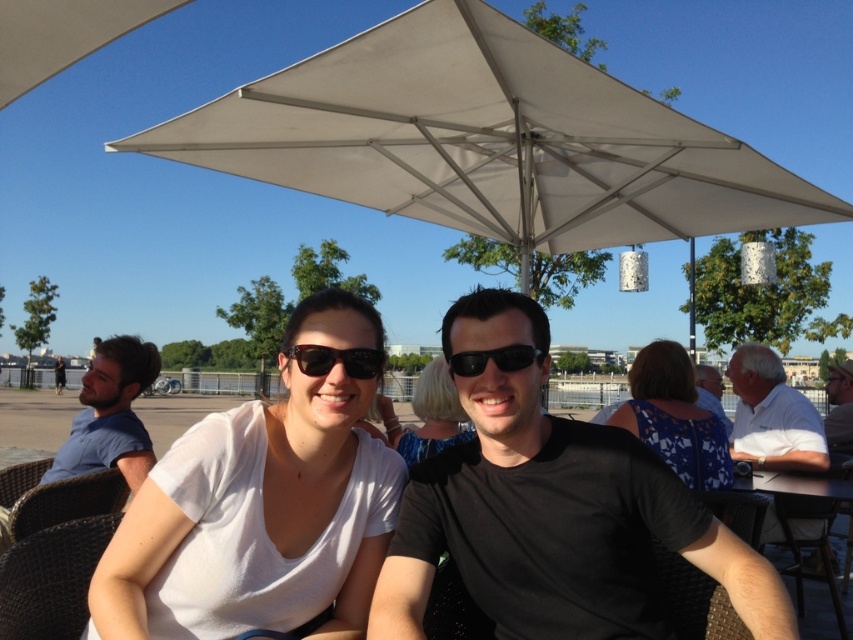
Question: Which point is farther to the camera?

Choices:
 (A) (378, 364)
 (B) (512, 33)
 (C) (138, 474)
 (D) (695, 385)

Answer: (D)

Question: Does blue floral dress at center lie behind black plastic sunglasses at center?

Choices:
 (A) yes
 (B) no

Answer: (A)

Question: Is matte black sunglasses at center bigger than white fabric shirt at upper right?

Choices:
 (A) no
 (B) yes

Answer: (A)

Question: Which of these objects is positioned farthest from the wooden table at lower right?

Choices:
 (A) black plastic sunglasses at center
 (B) blue cotton shirt at left
 (C) white fabric umbrella at upper center

Answer: (B)

Question: Observing the image, what is the correct spatial positioning of white fabric umbrella at upper center in reference to black matte shirt at center?

Choices:
 (A) below
 (B) above

Answer: (B)

Question: Which point appears farthest from the camera in this image?

Choices:
 (A) pos(683,358)
 (B) pos(492,355)

Answer: (A)